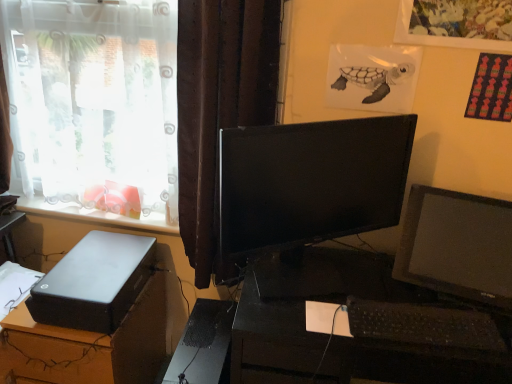
The image size is (512, 384). Find the location of `vacant space situated above matte black hard drive at lower left (from a real-world perspective)`. vacant space situated above matte black hard drive at lower left (from a real-world perspective) is located at coordinates (94, 259).